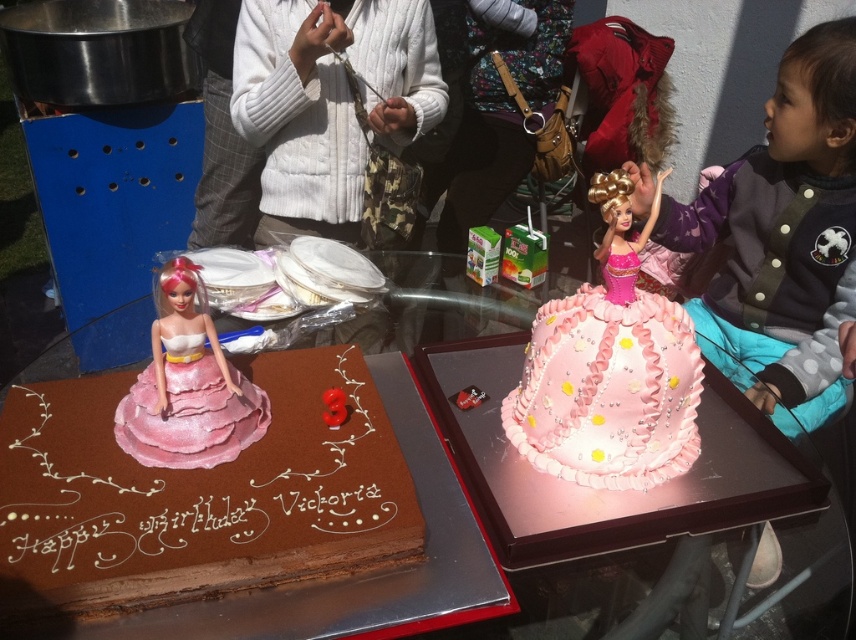
Question: Estimate the real-world distances between objects in this image. Which object is closer to the pink frosted cake at center?

Choices:
 (A) light blue denim pants at right
 (B) white fuzzy sweater at upper center
 (C) matte pink fabric doll at center

Answer: (C)

Question: Does pink frosted cake at center have a larger size compared to pink satin doll at upper right?

Choices:
 (A) no
 (B) yes

Answer: (A)

Question: Considering the real-world distances, which object is farthest from the pink frosted cake at center?

Choices:
 (A) white fuzzy sweater at upper center
 (B) pink satin doll at upper right
 (C) matte pink fabric doll at center
 (D) light blue denim pants at right

Answer: (A)

Question: Does chocolate matte cake at left lie behind pink satin doll at upper right?

Choices:
 (A) no
 (B) yes

Answer: (A)

Question: Among these objects, which one is nearest to the camera?

Choices:
 (A) white fuzzy sweater at upper center
 (B) chocolate matte cake at left
 (C) light blue denim pants at right
 (D) matte pink fabric doll at center

Answer: (B)

Question: Does chocolate matte cake at left have a larger size compared to white fuzzy sweater at upper center?

Choices:
 (A) no
 (B) yes

Answer: (A)